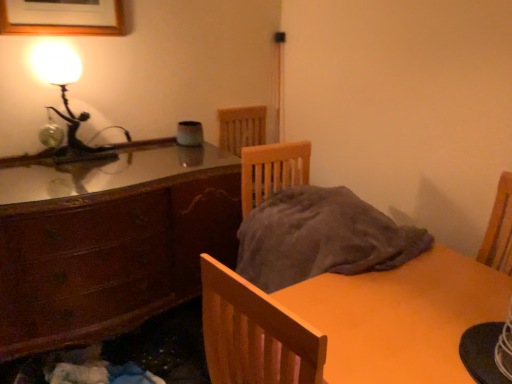
Question: Would you say wooden picture frame at upper left is inside or outside matte glass lamp at upper left?

Choices:
 (A) inside
 (B) outside

Answer: (B)

Question: In terms of size, does wooden picture frame at upper left appear bigger or smaller than matte glass lamp at upper left?

Choices:
 (A) small
 (B) big

Answer: (A)

Question: Based on their relative distances, which object is nearer to the wooden picture frame at upper left?

Choices:
 (A) matte wooden table at lower right
 (B) matte glass lamp at upper left
 (C) wooden cabinet at left

Answer: (B)

Question: Estimate the real-world distances between objects in this image. Which object is closer to the matte wooden table at lower right?

Choices:
 (A) wooden cabinet at left
 (B) wooden picture frame at upper left
 (C) matte glass lamp at upper left

Answer: (A)